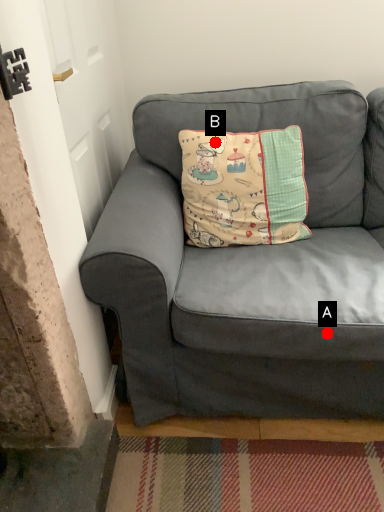
Question: Two points are circled on the image, labeled by A and B beside each circle. Which point appears closest to the camera in this image?

Choices:
 (A) A is closer
 (B) B is closer

Answer: (A)